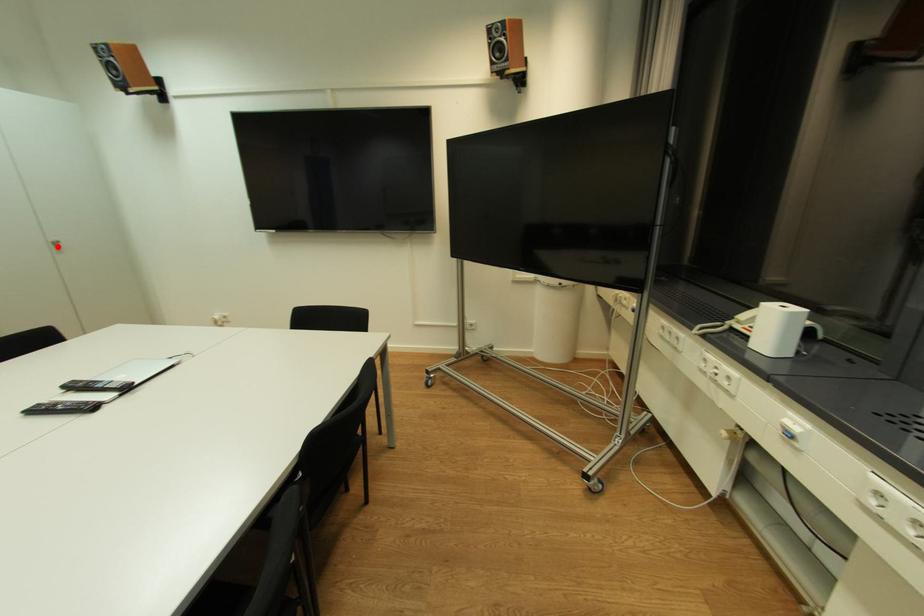
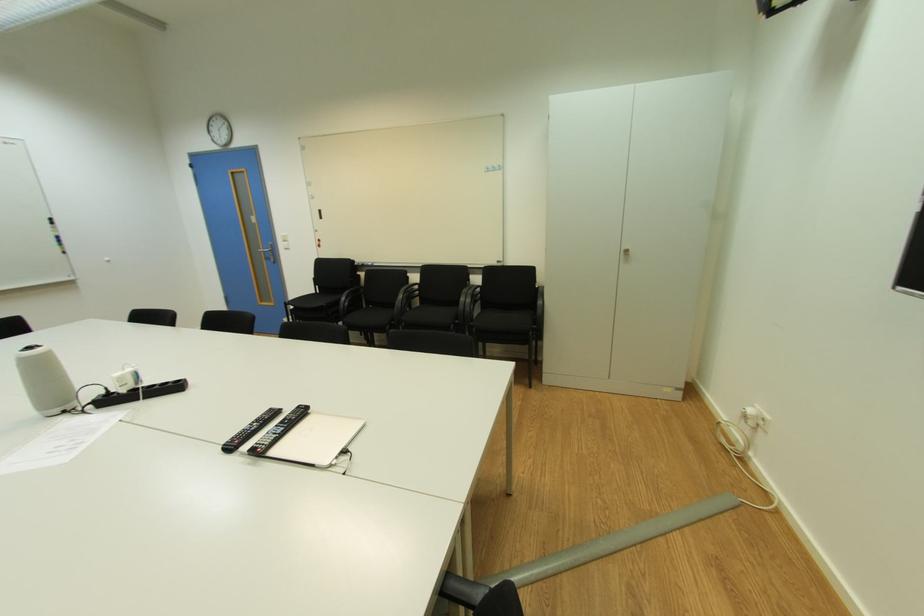
Find the pixel in the second image that matches the highlighted location in the first image.

(628, 254)